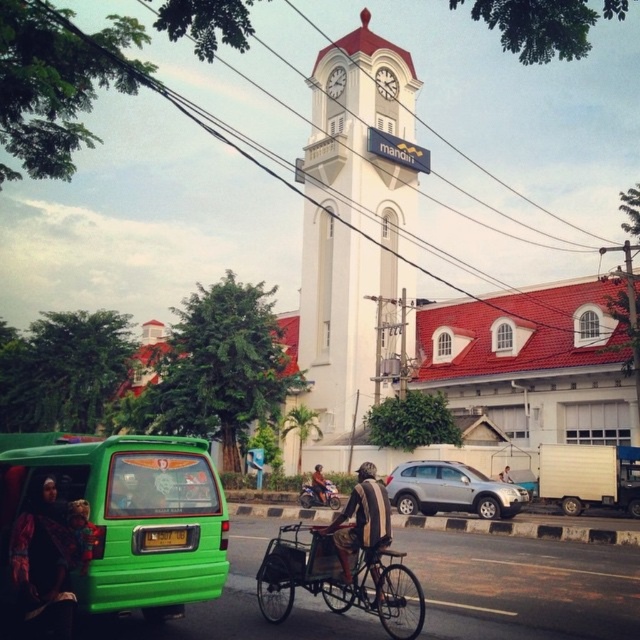
You are standing at point [48,561] in the image. What object is located at this point?

The dark fabric headscarf at lower left is located at point [48,561].

Looking at this image, you are a delivery person trying to navigate through the street in the image. You see a dark fabric headscarf at lower left and a striped fabric jacket at center. Which object takes up more space in the image?

The striped fabric jacket at center takes up more space than the dark fabric headscarf at lower left.